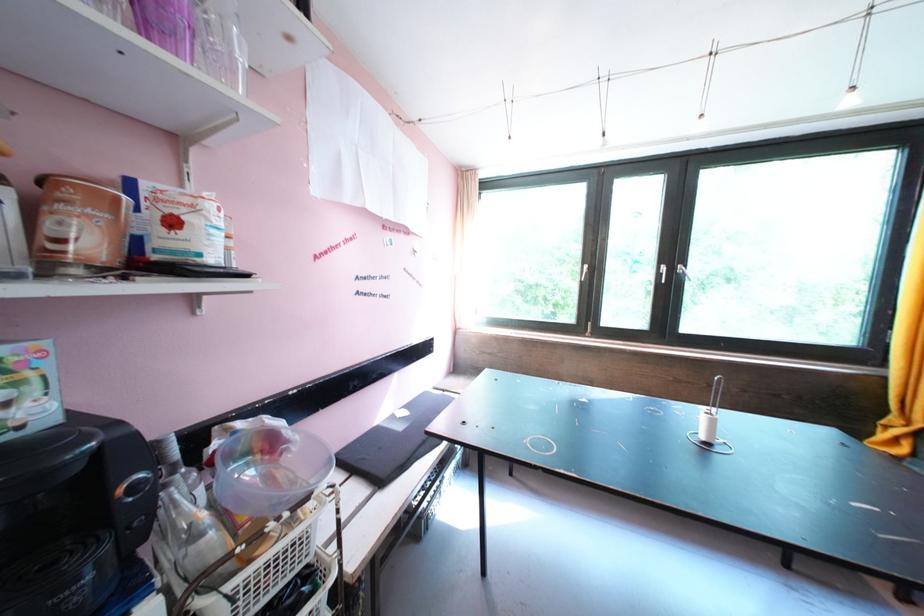
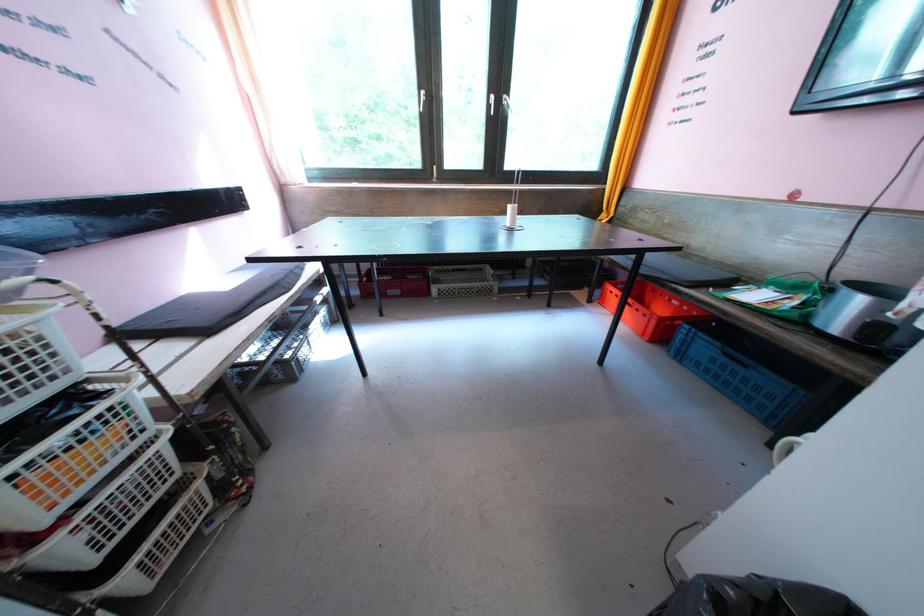
Where in the second image is the point corresponding to [711,440] from the first image?

(517, 227)